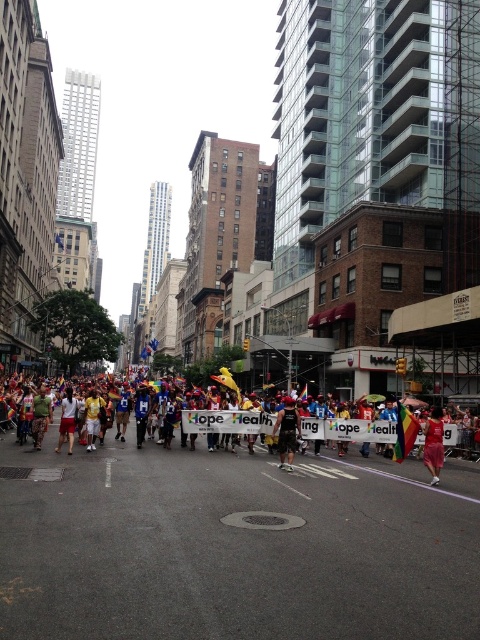
You are a photographer standing on the sidewalk observing the parade. You want to capture both the multicolored fabric banner at center and the black matte running suit at center in your shot. Which object should you focus on first if you want to ensure both are in frame without moving the camera?

The multicolored fabric banner at center has a lesser height compared to the black matte running suit at center. Therefore, focus on the multicolored fabric banner at center first to ensure it fits within the frame before adjusting for the taller black matte running suit at center.

You are a photographer at the event and want to capture both the black matte running suit at center and the red satin dress at center in a single frame. Given their sizes, which one should you focus on to ensure both are visible without cropping?

The black matte running suit at center is smaller than the red satin dress at center, so focusing on the smaller black matte running suit at center would allow the larger red satin dress at center to fit within the frame without cropping.